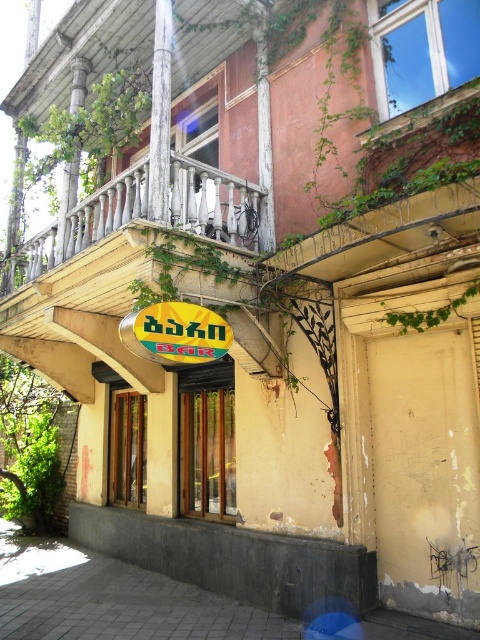
Is point (311, 268) positioned behind point (129, 330)?

Yes.

Who is lower down, rusty metal balcony at upper center or yellow matte sign at center?

yellow matte sign at center is lower down.

Is point (336, 266) behind point (147, 312)?

Yes, point (336, 266) is behind point (147, 312).

I want to click on rusty metal balcony at upper center, so click(x=382, y=236).